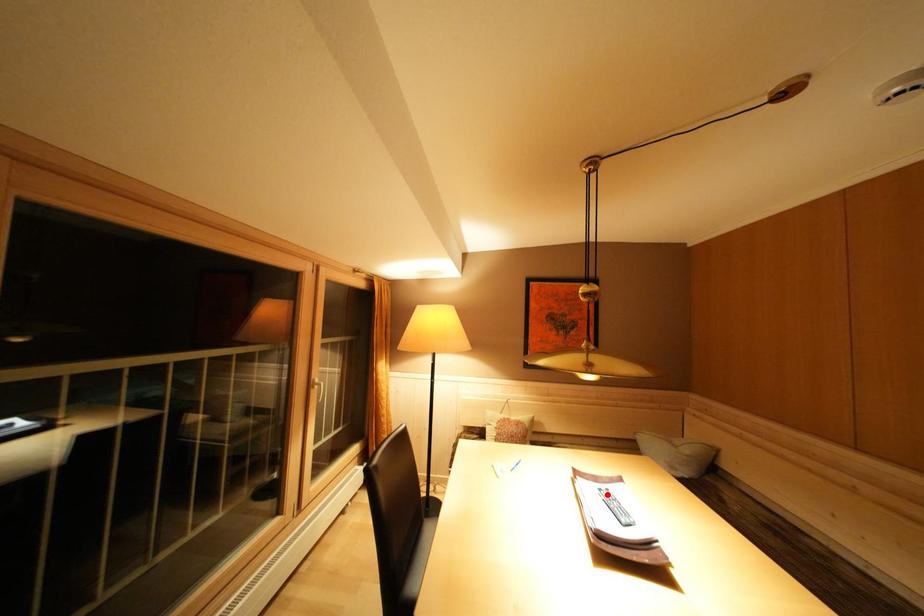
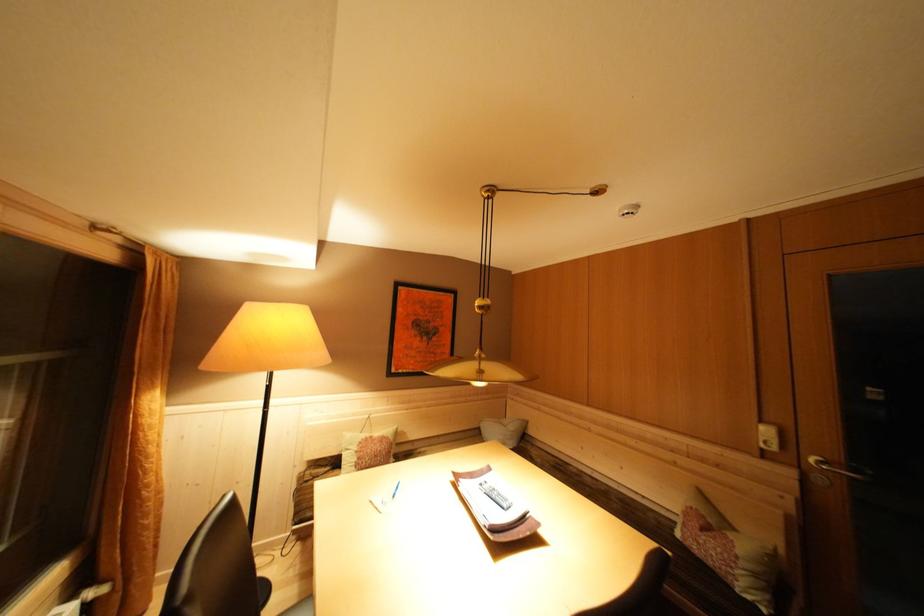
Locate, in the second image, the point that corresponds to the highlighted location in the first image.

(488, 488)